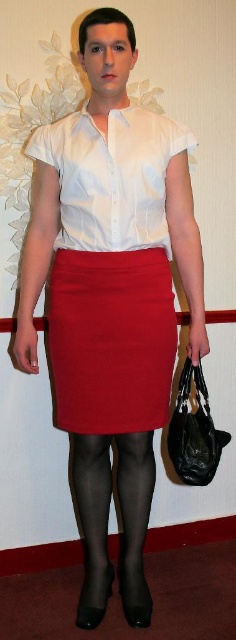
Who is positioned more to the right, white glossy shirt at center or black sheer tights at lower center?

white glossy shirt at center is more to the right.

Between white glossy shirt at center and black sheer tights at lower center, which one appears on the left side from the viewer's perspective?

black sheer tights at lower center is more to the left.

Image resolution: width=236 pixels, height=640 pixels. I want to click on white glossy shirt at center, so click(112, 177).

From the picture: Is matte red skirt at center above white glossy shirt at center?

No, matte red skirt at center is not above white glossy shirt at center.

Is point (97, 312) farther from viewer compared to point (159, 163)?

Yes, point (97, 312) is behind point (159, 163).

Does point (139, 412) come in front of point (151, 144)?

No, (139, 412) is further to viewer.

You are a GUI agent. You are given a task and a screenshot of the screen. Output one action in this format:
    pyautogui.click(x=<x>, y=<y>)
    Task: Click on the matte red skirt at center
    The width and height of the screenshot is (236, 640).
    Given the screenshot: What is the action you would take?
    pyautogui.click(x=110, y=340)

Does matte red skirt at center have a smaller size compared to black sheer tights at lower center?

Yes.

From the picture: Is the position of matte red skirt at center more distant than that of black sheer tights at lower center?

No.

Who is more distant from viewer, (101,397) or (80,490)?

The point (80,490) is behind.

The width and height of the screenshot is (236, 640). What are the coordinates of `matte red skirt at center` in the screenshot? It's located at (110, 340).